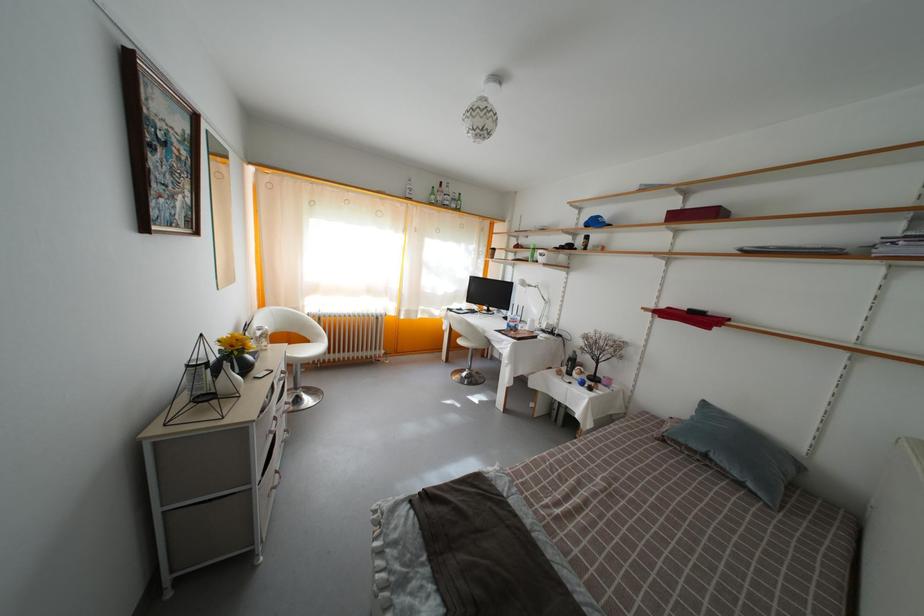
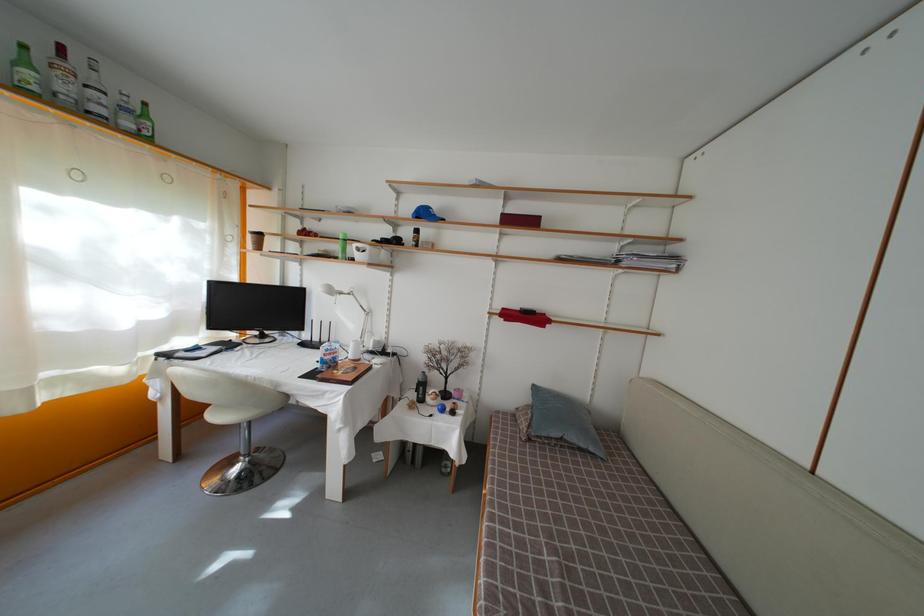
Locate, in the second image, the point that corresponds to [687,459] in the first image.

(550, 450)